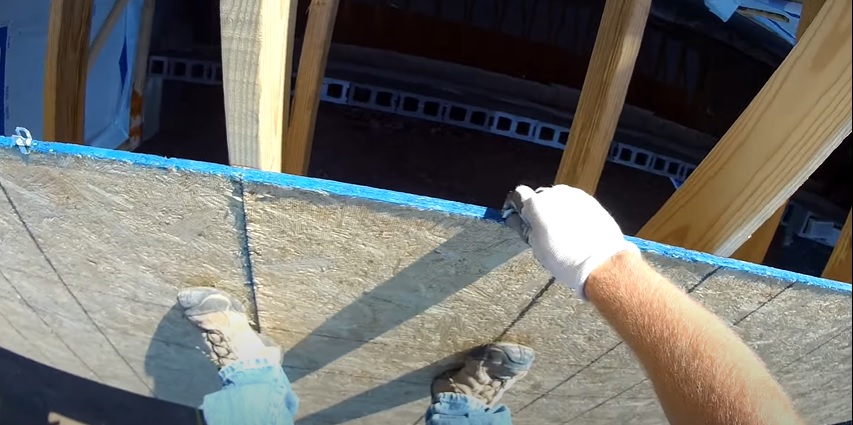
Identify the location of floorboard. This screenshot has width=853, height=425. (344, 290).